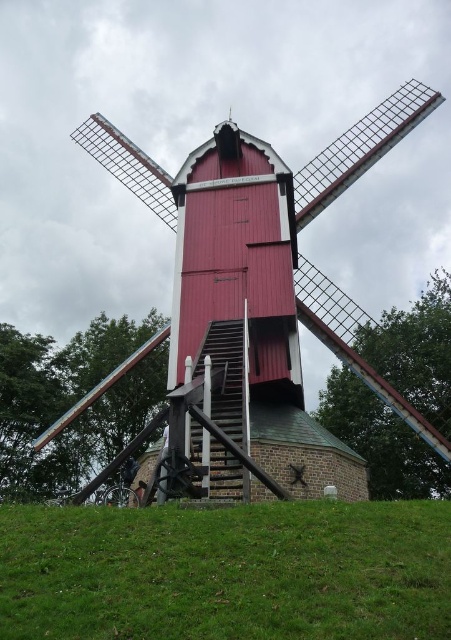
You are standing on the green grassy hill at lower center and want to reach the wooden windmill at center. Which direction should you move to get closer to the windmill?

Since the green grassy hill at lower center is at the lower part of the image and the wooden windmill at center is centrally located, you should move upward towards the center of the scene to reach the wooden windmill at center.

You are standing on the green grassy hill at lower center and want to walk to the wooden windmill at center. Which direction should you move to reach it?

Since the green grassy hill at lower center is closer to the viewer than the wooden windmill at center, you should move forward towards the wooden windmill at center to reach it.